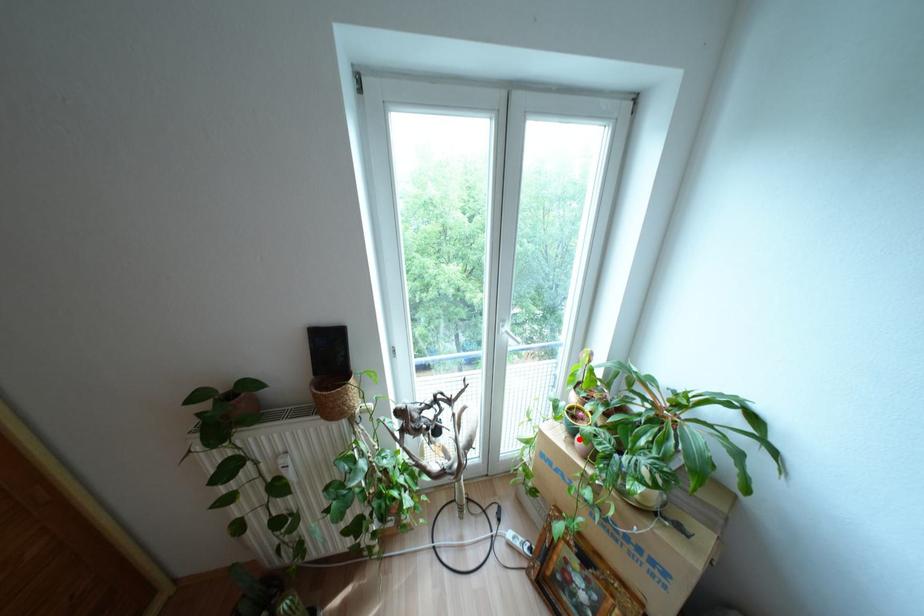
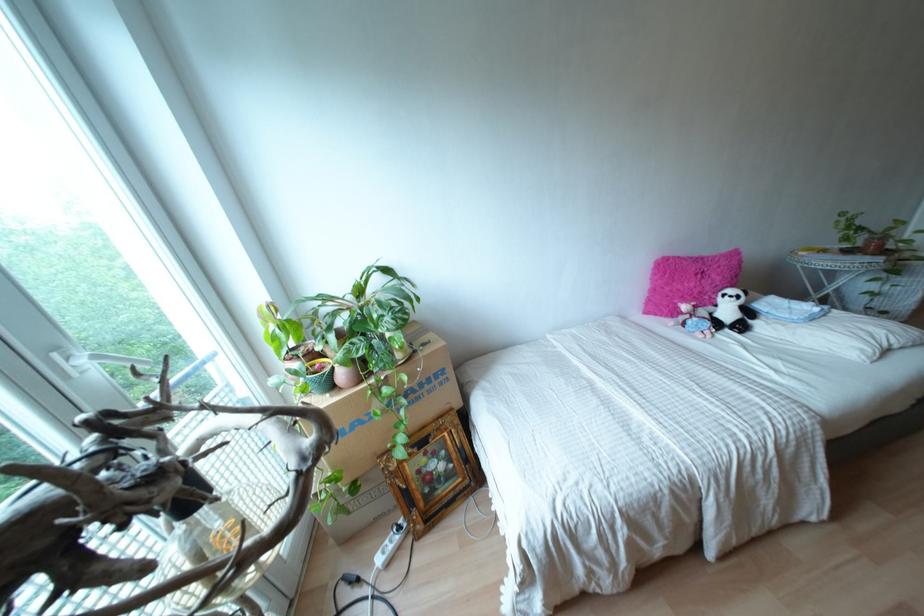
In the second image, find the point that corresponds to the highlighted location in the first image.

(342, 374)